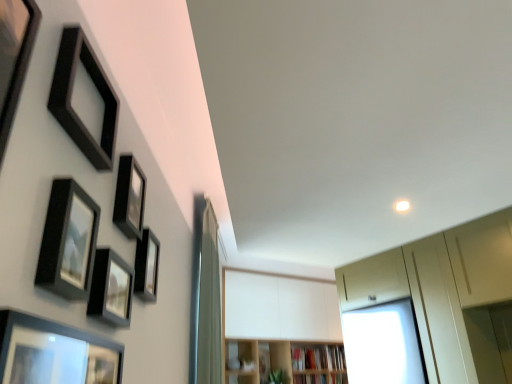
Question: Could silky white curtain at center be considered to be inside matte black picture frame at lower left, the 1th picture frame viewed from the front?

Choices:
 (A) yes
 (B) no

Answer: (B)

Question: Is matte black picture frame at lower left, the 1th picture frame viewed from the front, in contact with silky white curtain at center?

Choices:
 (A) no
 (B) yes

Answer: (A)

Question: Is matte black picture frame at lower left, the 6th picture frame viewed from the back, facing away from silky white curtain at center?

Choices:
 (A) yes
 (B) no

Answer: (B)

Question: Considering the relative positions of matte black picture frame at lower left, the 6th picture frame viewed from the back, and silky white curtain at center in the image provided, is matte black picture frame at lower left, the 6th picture frame viewed from the back, in front of silky white curtain at center?

Choices:
 (A) no
 (B) yes

Answer: (B)

Question: From a real-world perspective, is matte black picture frame at lower left, the 1th picture frame viewed from the front, physically above silky white curtain at center?

Choices:
 (A) no
 (B) yes

Answer: (A)

Question: Does matte black picture frame at lower left, the 6th picture frame viewed from the back, have a smaller size compared to silky white curtain at center?

Choices:
 (A) no
 (B) yes

Answer: (B)

Question: Does matte black picture frame at upper left, marked as the 4th picture frame in a front-to-back arrangement, have a smaller size compared to wooden bookshelf at lower center, which is the 2th shelf in left-to-right order?

Choices:
 (A) no
 (B) yes

Answer: (B)

Question: From the image's perspective, is matte black picture frame at upper left, acting as the third picture frame starting from the back, located beneath wooden bookshelf at lower center, which is the 2th shelf in left-to-right order?

Choices:
 (A) no
 (B) yes

Answer: (A)

Question: Does matte black picture frame at upper left, marked as the 4th picture frame in a front-to-back arrangement, have a lesser width compared to wooden bookshelf at lower center, which is the 1th shelf from right to left?

Choices:
 (A) yes
 (B) no

Answer: (A)

Question: Can you confirm if matte black picture frame at upper left, marked as the 4th picture frame in a front-to-back arrangement, is bigger than wooden bookshelf at lower center, which is the 2th shelf in left-to-right order?

Choices:
 (A) no
 (B) yes

Answer: (A)

Question: Is matte black picture frame at upper left, acting as the third picture frame starting from the back, in front of wooden bookshelf at lower center, which is the 1th shelf from right to left?

Choices:
 (A) no
 (B) yes

Answer: (B)

Question: Can we say matte black picture frame at upper left, marked as the 4th picture frame in a front-to-back arrangement, lies outside wooden bookshelf at lower center, which is the 1th shelf from right to left?

Choices:
 (A) yes
 (B) no

Answer: (A)

Question: Considering the relative sizes of matte black picture frame at upper left, marked as the 4th picture frame in a front-to-back arrangement, and matte black picture frame at center-left, positioned as the sixth picture frame in front-to-back order, in the image provided, is matte black picture frame at upper left, marked as the 4th picture frame in a front-to-back arrangement, wider than matte black picture frame at center-left, positioned as the sixth picture frame in front-to-back order,?

Choices:
 (A) yes
 (B) no

Answer: (A)